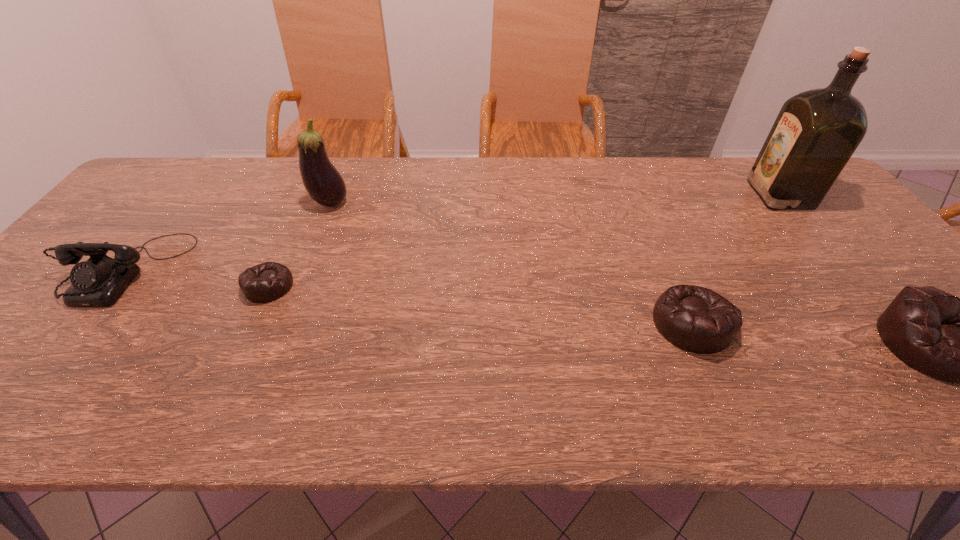
Locate an element on the screen. The height and width of the screenshot is (540, 960). the shortest object is located at coordinates (269, 281).

Where is `the shortest beanbag`? This screenshot has height=540, width=960. the shortest beanbag is located at coordinates (269, 281).

Identify the location of the second shortest object. The height and width of the screenshot is (540, 960). click(x=696, y=319).

Image resolution: width=960 pixels, height=540 pixels. I want to click on the second beanbag from left to right, so click(696, 319).

Locate an element on the screen. The image size is (960, 540). eggplant is located at coordinates (324, 184).

I want to click on liquor, so click(x=816, y=132).

Find the location of a particular element. This screenshot has height=540, width=960. telephone is located at coordinates (98, 282).

You are a GUI agent. You are given a task and a screenshot of the screen. Output one action in this format:
    pyautogui.click(x=<x>, y=<y>)
    Task: Click on the free space located 0.370m on the right of the shortest object
    
    Given the screenshot: What is the action you would take?
    pyautogui.click(x=444, y=286)

You are a GUI agent. You are given a task and a screenshot of the screen. Output one action in this format:
    pyautogui.click(x=<x>, y=<y>)
    Task: Click on the free space located 0.340m on the left of the second beanbag from left to right
    
    Given the screenshot: What is the action you would take?
    pyautogui.click(x=502, y=323)

I want to click on vacant space located on the left of the eggplant, so click(x=230, y=203).